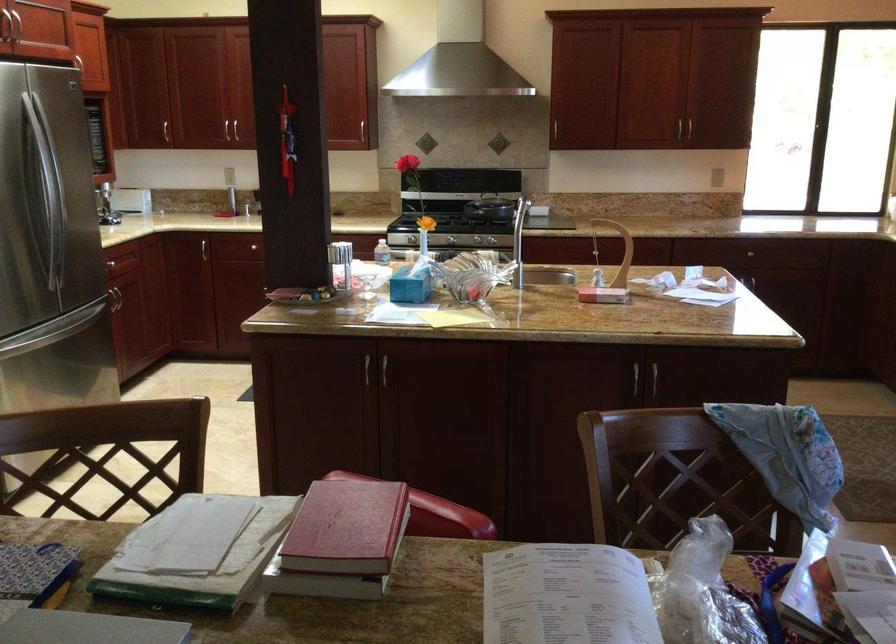
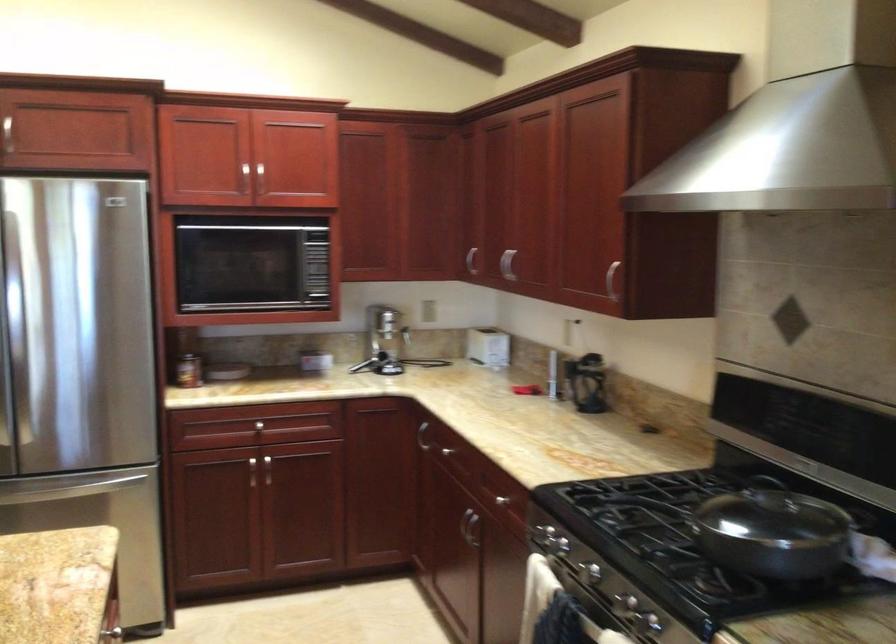
Question: I am providing you with two images of the same scene from different viewpoints. After the viewpoint changes to image2, which objects are now occluded?

Choices:
 (A) silver cabinet handle
 (B) faucet lever handle
 (C) off-white pillow
 (D) refrigerator handle

Answer: (A)